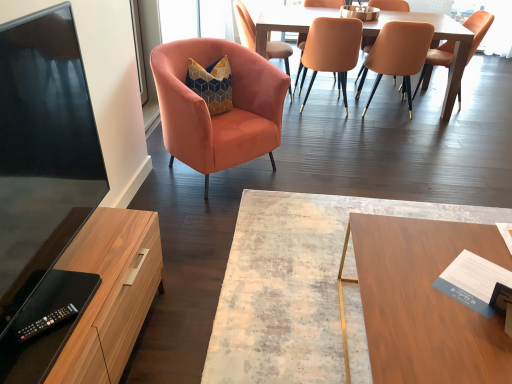
Where is `empty space that is ontop of wooden desk at center (from a real-world perspective)`? empty space that is ontop of wooden desk at center (from a real-world perspective) is located at coordinates (437, 283).